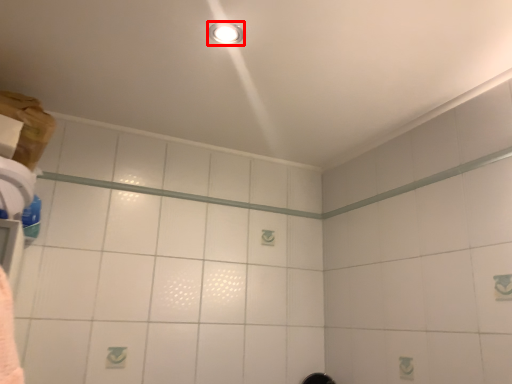
Question: From the image's perspective, where is light fixture (annotated by the red box) located in relation to beam in the image?

Choices:
 (A) below
 (B) above

Answer: (B)